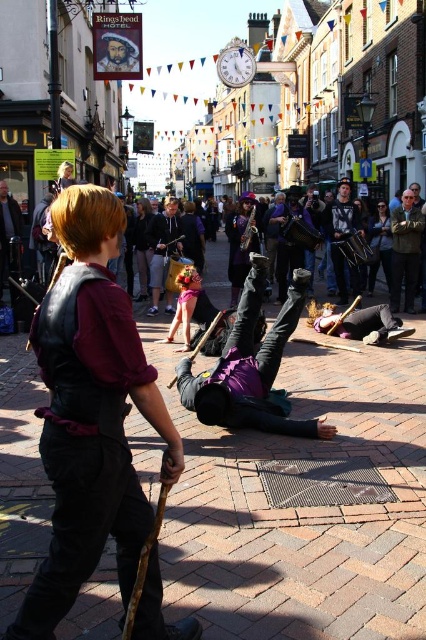
You are a costume designer preparing for a play and need to choose between two jackets for a character. The character requires a larger jacket to emphasize their authority. Looking at the image, which of the leather vest at center or denim jacket at center would you select?

The leather vest at center is larger in size than the denim jacket at center, so the leather vest at center would be the better choice to emphasize authority.

You are a photographer positioned at the center of the square and want to capture the suede jacket at right in your shot. Given the coordinates provided, is the jacket positioned to your left or right side?

The suede jacket at right is located at point 0.392 on the x and 0.951 on the y. Since the photographer is at the center, the jacket is to the right side because its x coordinate is greater than 0.5.